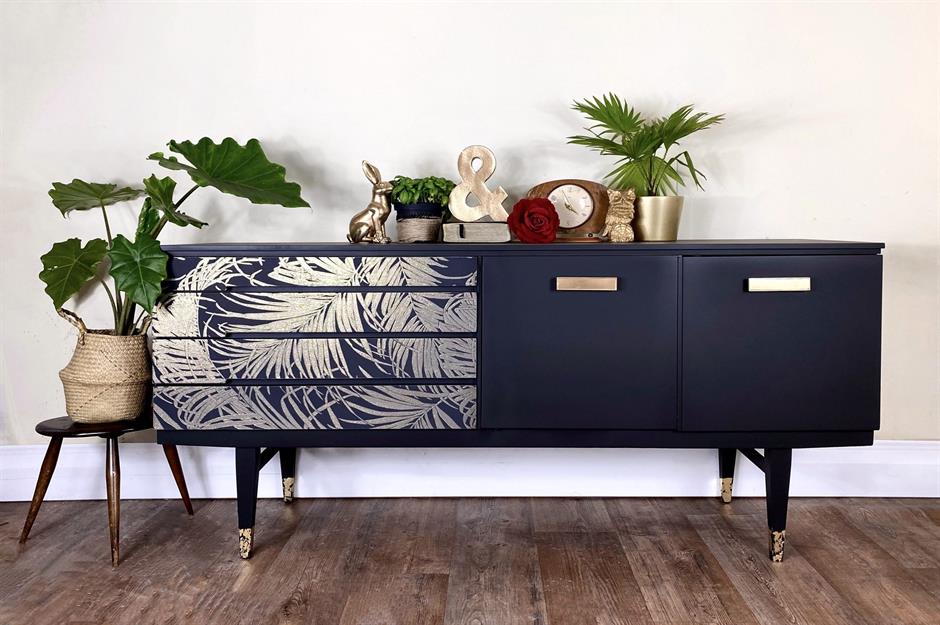
You are a GUI agent. You are given a task and a screenshot of the screen. Output one action in this format:
    pyautogui.click(x=<x>, y=<y>)
    Task: Click on the wicker basket
    
    Given the screenshot: What is the action you would take?
    pyautogui.click(x=131, y=350)